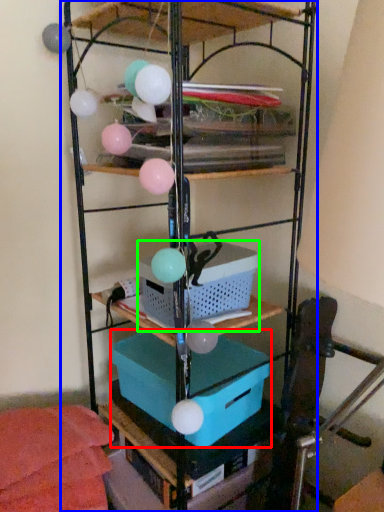
Question: Considering the real-world distances, which object is closest to box (highlighted by a red box)? shelf (highlighted by a blue box) or basket (highlighted by a green box).

Choices:
 (A) shelf
 (B) basket

Answer: (B)